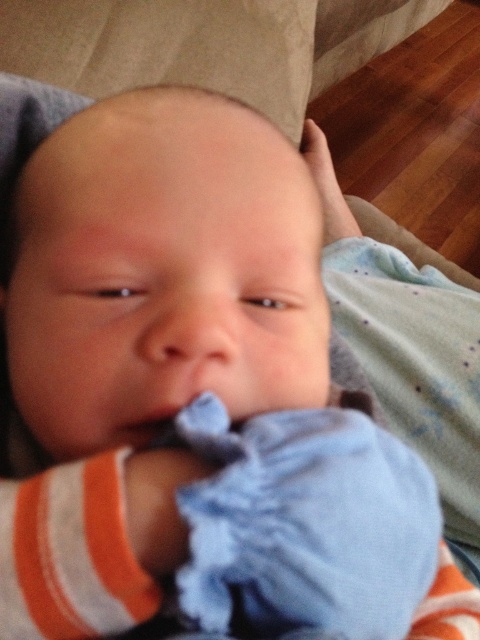
You are a photographer taking a closeup shot of a baby. You notice the smooth skin nose at center and the smooth blue cloth at center. Which object is closer to the camera?

The smooth skin nose at center is closer to the camera because it is in front of the smooth blue cloth at center.

You are a photographer taking a closeup shot of a baby. You notice the smooth skin nose at center and the smooth blue cloth at center. Which object is located higher in the image?

The smooth skin nose at center is positioned over the smooth blue cloth at center, so it is higher in the image.